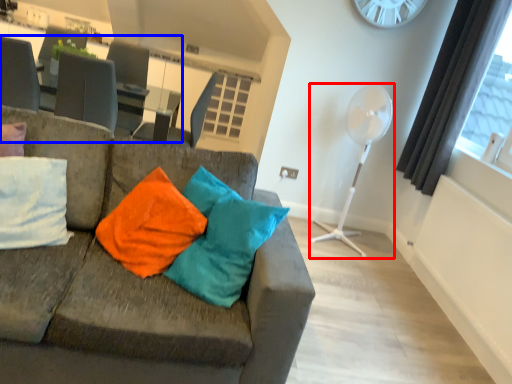
Question: Which object is further to the camera taking this photo, fan (highlighted by a red box) or table (highlighted by a blue box)?

Choices:
 (A) fan
 (B) table

Answer: (B)